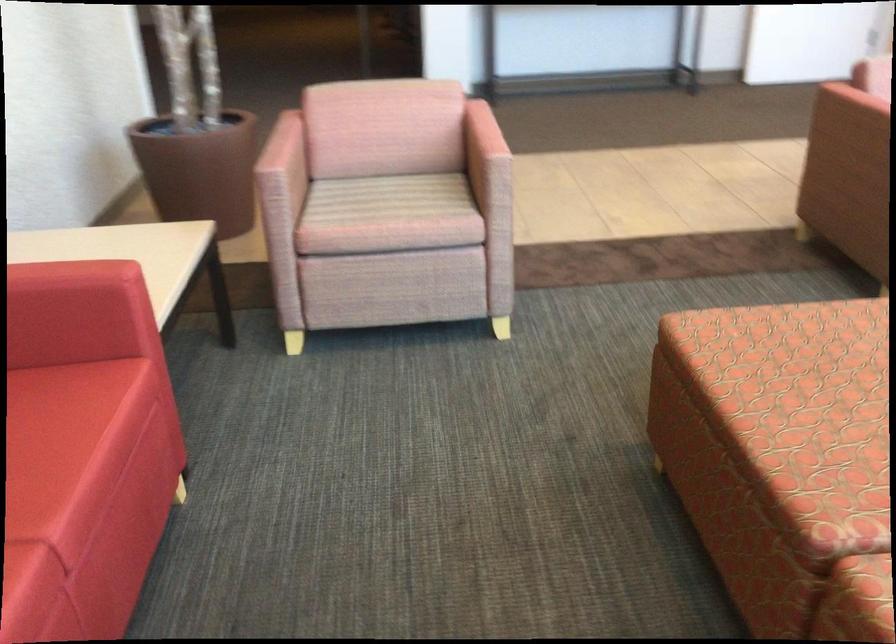
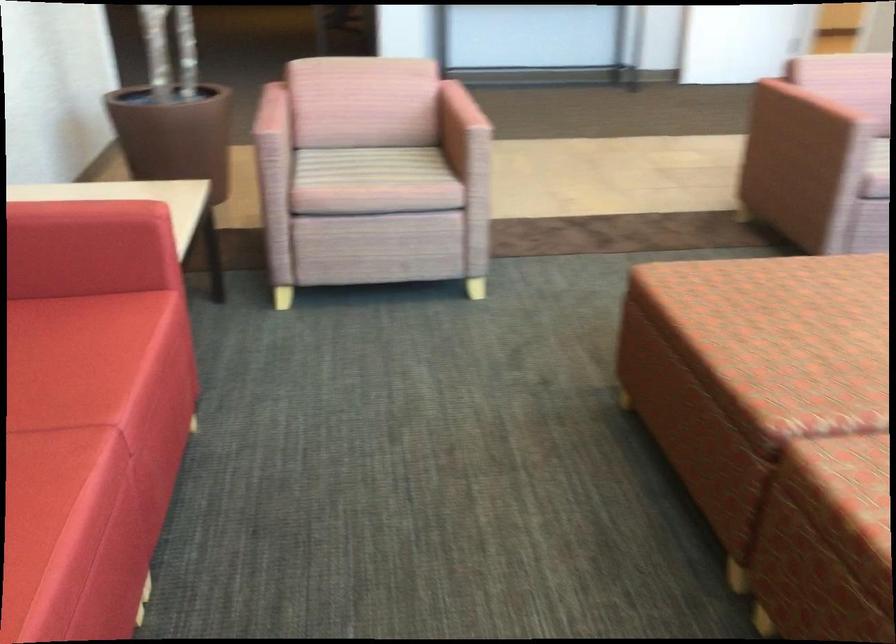
Where in the second image is the point corresponding to (74,276) from the first image?

(108, 211)